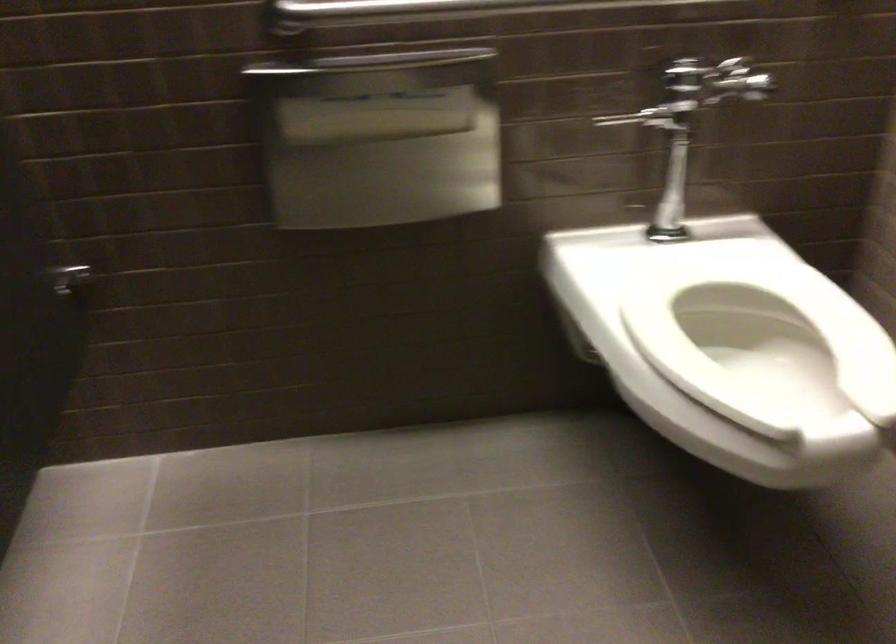
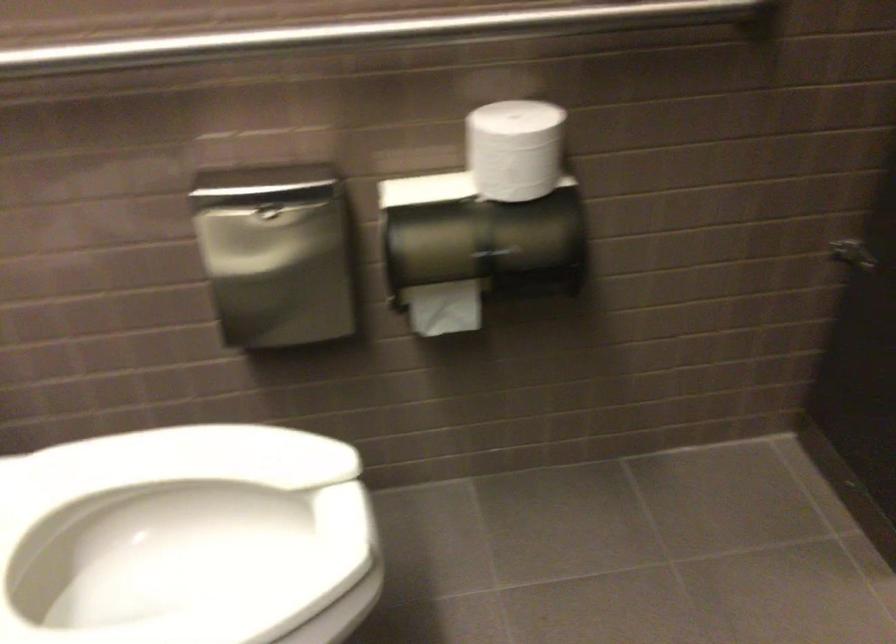
Locate, in the second image, the point that corresponds to point 798,389 in the first image.

(186, 538)